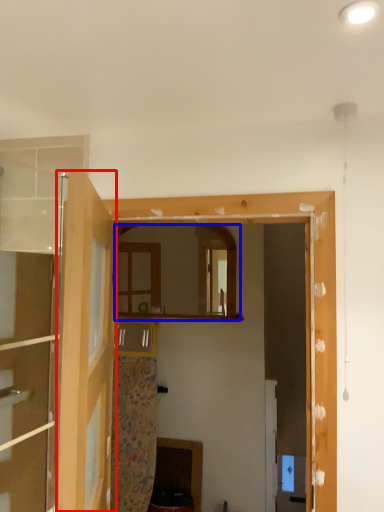
Question: Which point is closer to the camera, door (highlighted by a red box) or mirror (highlighted by a blue box)?

Choices:
 (A) door
 (B) mirror

Answer: (A)